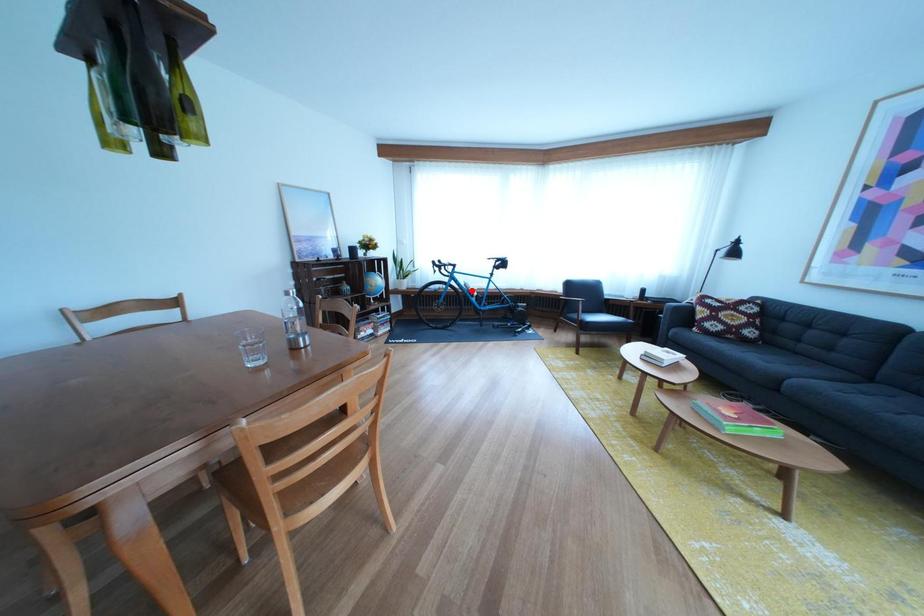
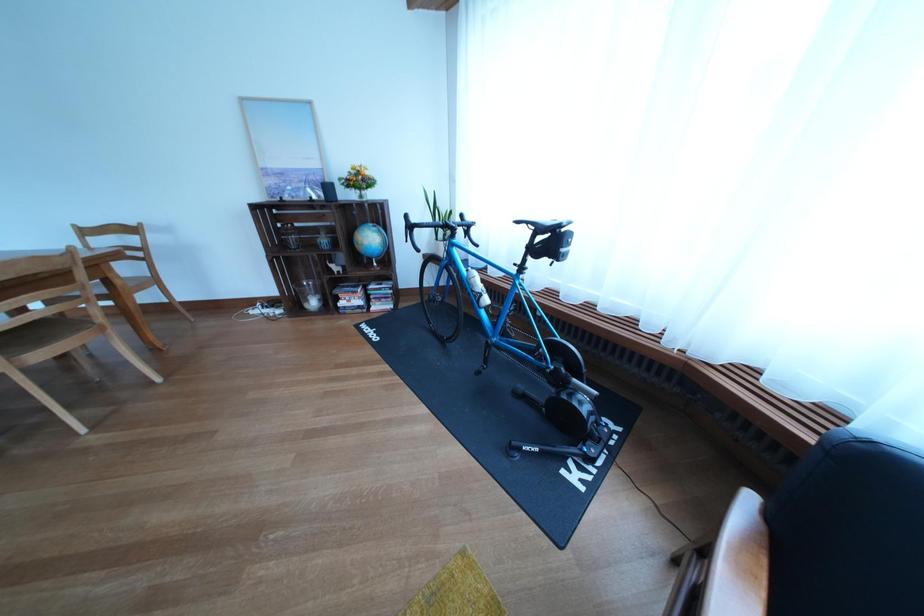
Question: I am providing you with two images of the same scene from different viewpoints. In image1, a red point is highlighted. Considering the same 3D point in image2, which of the following is correct?

Choices:
 (A) It is closer
 (B) It is farther

Answer: (B)